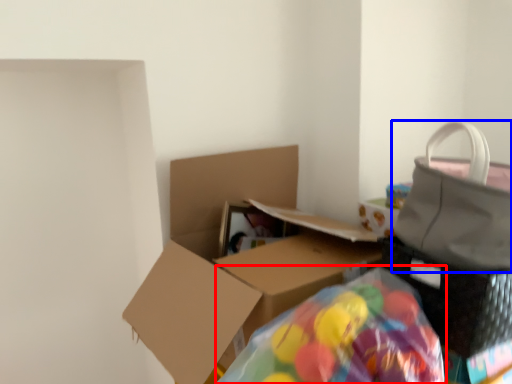
Question: Which point is further to the camera, bean bag chair (highlighted by a red box) or handbag (highlighted by a blue box)?

Choices:
 (A) bean bag chair
 (B) handbag

Answer: (B)